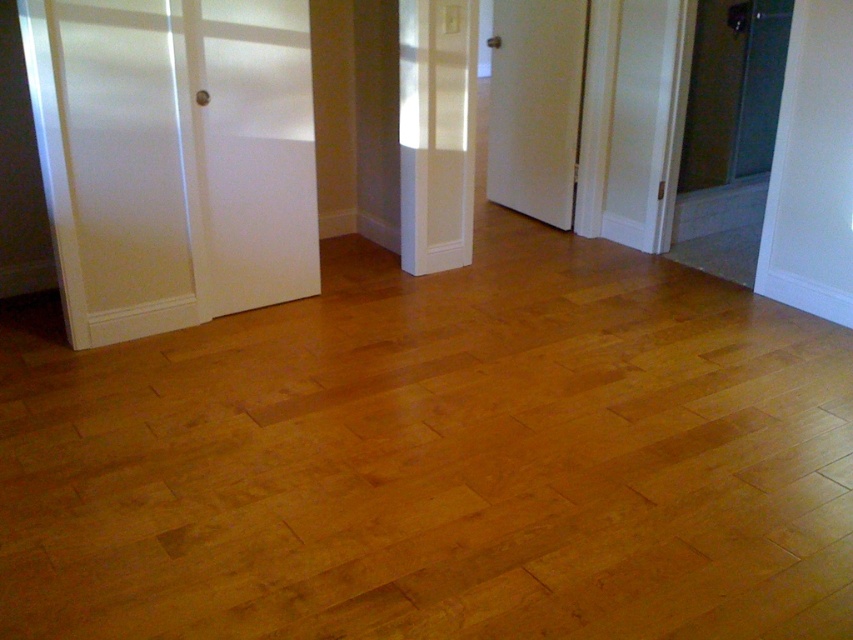
Question: Considering the real-world distances, which object is closest to the white glossy door at left?

Choices:
 (A) white matte door at center
 (B) white wood door at center

Answer: (A)

Question: Among these objects, which one is farthest from the camera?

Choices:
 (A) white wood door at center
 (B) white glossy door at left

Answer: (A)

Question: Can you confirm if white matte door at center is smaller than white wood door at center?

Choices:
 (A) yes
 (B) no

Answer: (A)

Question: Is white glossy door at left closer to the viewer compared to white wood door at center?

Choices:
 (A) yes
 (B) no

Answer: (A)

Question: Among these objects, which one is nearest to the camera?

Choices:
 (A) white wood door at center
 (B) white matte door at center

Answer: (B)

Question: Does white glossy door at left appear on the left side of white wood door at center?

Choices:
 (A) no
 (B) yes

Answer: (B)